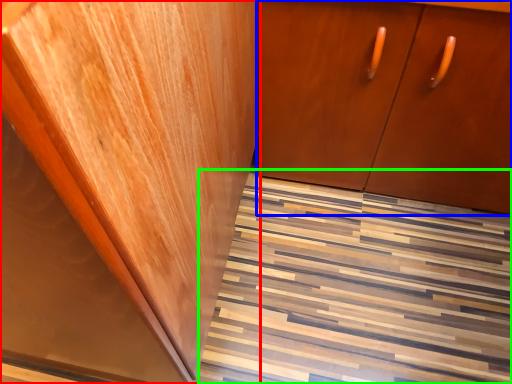
Question: Considering the real-world distances, which object is closest to cabinetry (highlighted by a red box)? cabinetry (highlighted by a blue box) or stairwell (highlighted by a green box).

Choices:
 (A) cabinetry
 (B) stairwell

Answer: (A)